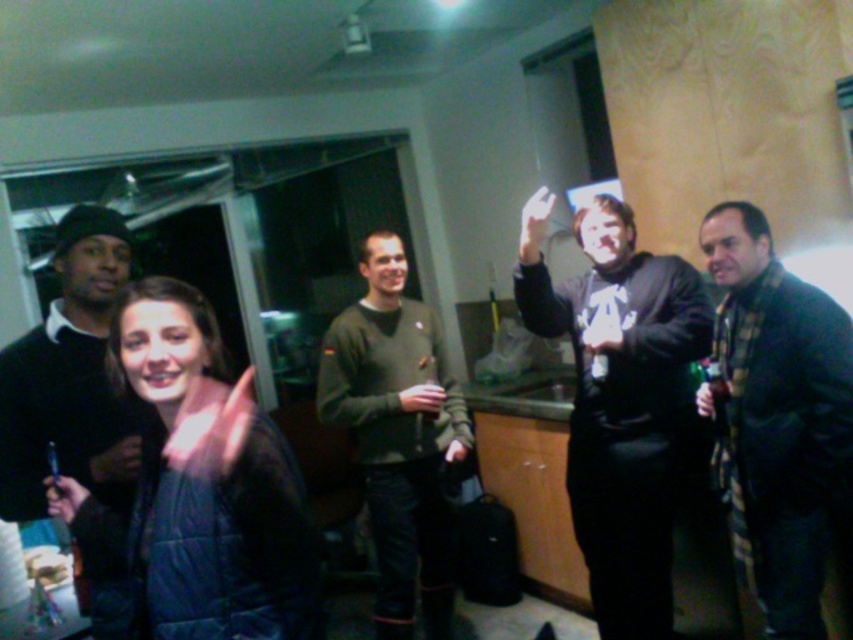
Question: Considering the relative positions of dark blue puffer jacket at center and black matte hoodie at center in the image provided, where is dark blue puffer jacket at center located with respect to black matte hoodie at center?

Choices:
 (A) below
 (B) above

Answer: (A)

Question: Which point appears closest to the camera in this image?

Choices:
 (A) (718, 468)
 (B) (614, 376)
 (C) (27, 368)

Answer: (C)

Question: Among these objects, which one is farthest from the camera?

Choices:
 (A) matte black sweater at left
 (B) black matte hoodie at center
 (C) dark blue puffer jacket at center

Answer: (B)

Question: Is flannel shirt at right positioned in front of matte black sweater at left?

Choices:
 (A) yes
 (B) no

Answer: (B)

Question: Is black matte hoodie at center bigger than flannel shirt at right?

Choices:
 (A) yes
 (B) no

Answer: (A)

Question: Which point is closer to the camera taking this photo?

Choices:
 (A) (820, 612)
 (B) (418, 445)
 (C) (73, 244)

Answer: (C)